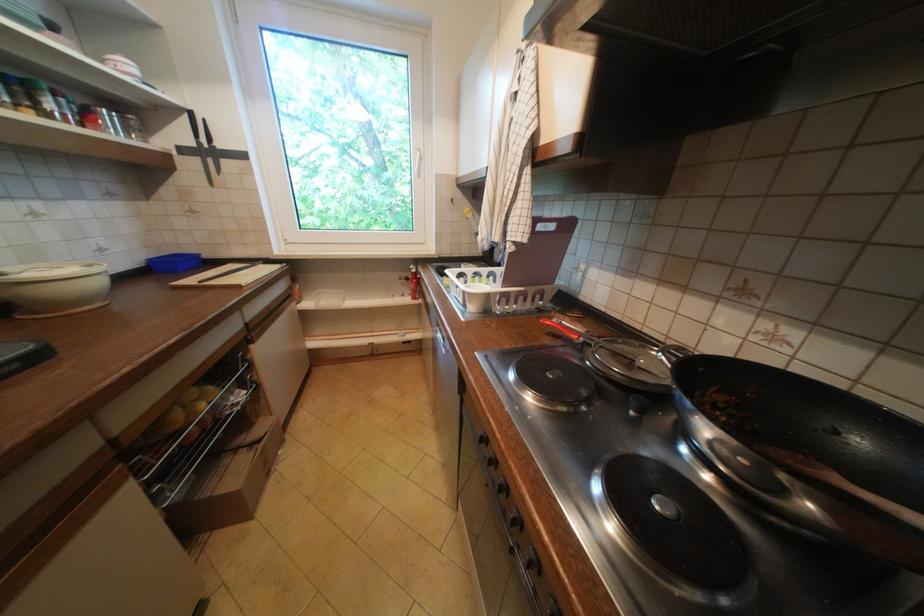
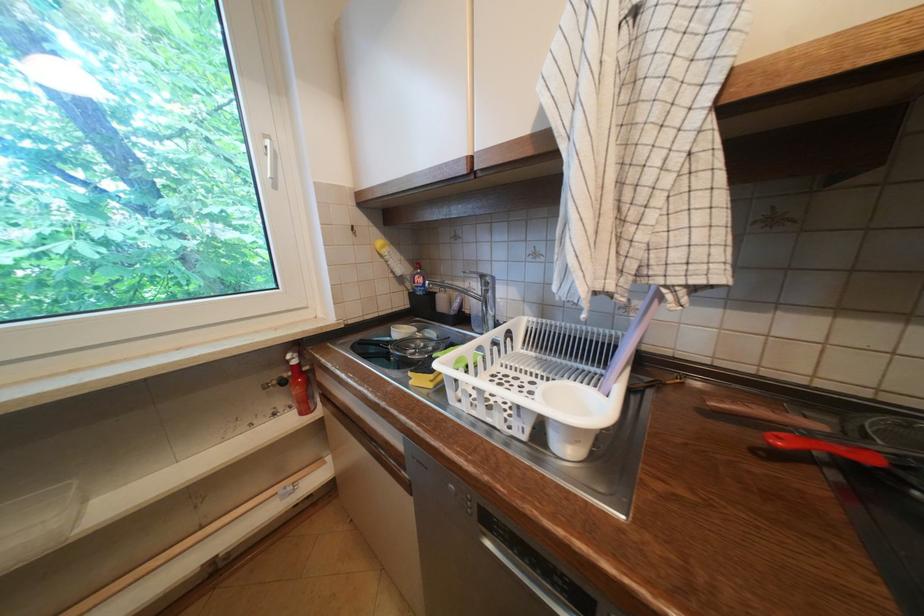
Find the pixel in the second image that matches pixel 453 283 in the first image.

(419, 383)